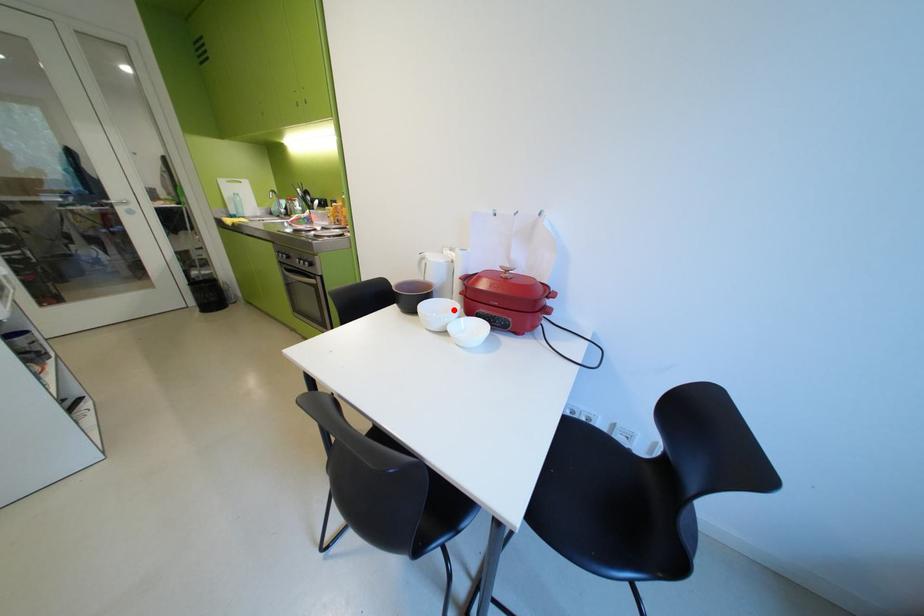
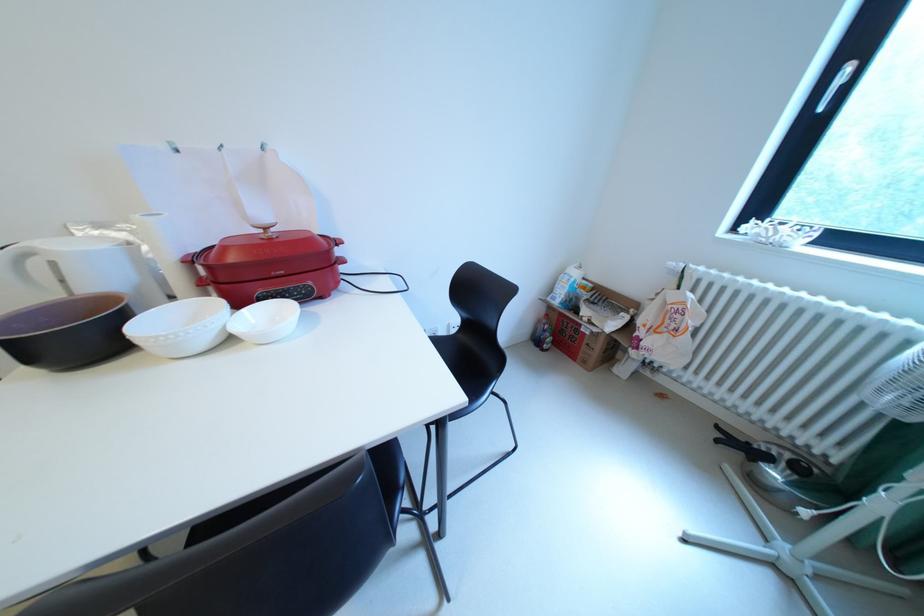
The point at the highlighted location is marked in the first image. Where is the corresponding point in the second image?

(193, 321)